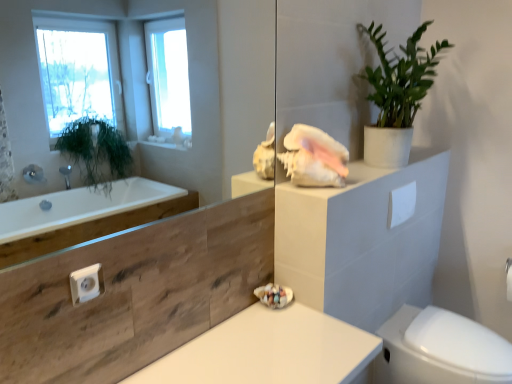
Question: Considering the relative positions of transparent glass mirror at upper center and white matte countertop at center in the image provided, is transparent glass mirror at upper center to the right of white matte countertop at center from the viewer's perspective?

Choices:
 (A) no
 (B) yes

Answer: (A)

Question: Is transparent glass mirror at upper center smaller than white matte countertop at center?

Choices:
 (A) no
 (B) yes

Answer: (B)

Question: Does transparent glass mirror at upper center appear on the left side of white matte countertop at center?

Choices:
 (A) yes
 (B) no

Answer: (A)

Question: Is white matte countertop at center located within transparent glass mirror at upper center?

Choices:
 (A) no
 (B) yes

Answer: (A)

Question: Could you tell me if transparent glass mirror at upper center is turned towards white matte countertop at center?

Choices:
 (A) yes
 (B) no

Answer: (B)

Question: Considering the positions of white matte toilet paper at upper right and transparent glass mirror at upper center in the image, is white matte toilet paper at upper right bigger or smaller than transparent glass mirror at upper center?

Choices:
 (A) big
 (B) small

Answer: (B)

Question: From their relative heights in the image, would you say white matte toilet paper at upper right is taller or shorter than transparent glass mirror at upper center?

Choices:
 (A) short
 (B) tall

Answer: (A)

Question: From a real-world perspective, is white matte toilet paper at upper right positioned above or below transparent glass mirror at upper center?

Choices:
 (A) below
 (B) above

Answer: (A)

Question: Based on their positions, is white matte toilet paper at upper right located to the left or right of transparent glass mirror at upper center?

Choices:
 (A) right
 (B) left

Answer: (A)

Question: Relative to green matte plant at upper right, is transparent glass mirror at upper center in front or behind?

Choices:
 (A) behind
 (B) front

Answer: (B)

Question: Is transparent glass mirror at upper center inside the boundaries of green matte plant at upper right, or outside?

Choices:
 (A) inside
 (B) outside

Answer: (B)

Question: In terms of width, does transparent glass mirror at upper center look wider or thinner when compared to green matte plant at upper right?

Choices:
 (A) wide
 (B) thin

Answer: (B)

Question: Considering the positions of transparent glass mirror at upper center and green matte plant at upper right in the image, is transparent glass mirror at upper center bigger or smaller than green matte plant at upper right?

Choices:
 (A) big
 (B) small

Answer: (B)

Question: Which is correct: white glossy bidet at lower right is inside green matte plant at upper right, or outside of it?

Choices:
 (A) outside
 (B) inside

Answer: (A)

Question: Looking at the image, does white glossy bidet at lower right seem bigger or smaller compared to green matte plant at upper right?

Choices:
 (A) big
 (B) small

Answer: (A)